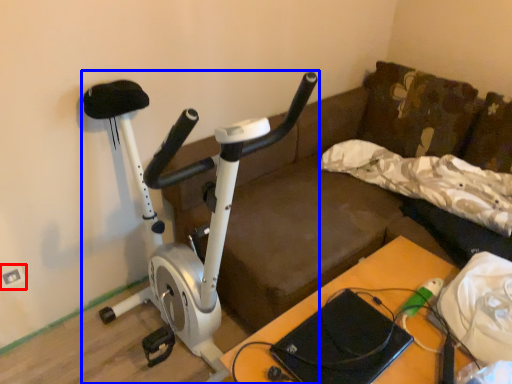
Question: Which point is further to the camera, electric outlet (highlighted by a red box) or stationary bicycle (highlighted by a blue box)?

Choices:
 (A) electric outlet
 (B) stationary bicycle

Answer: (A)